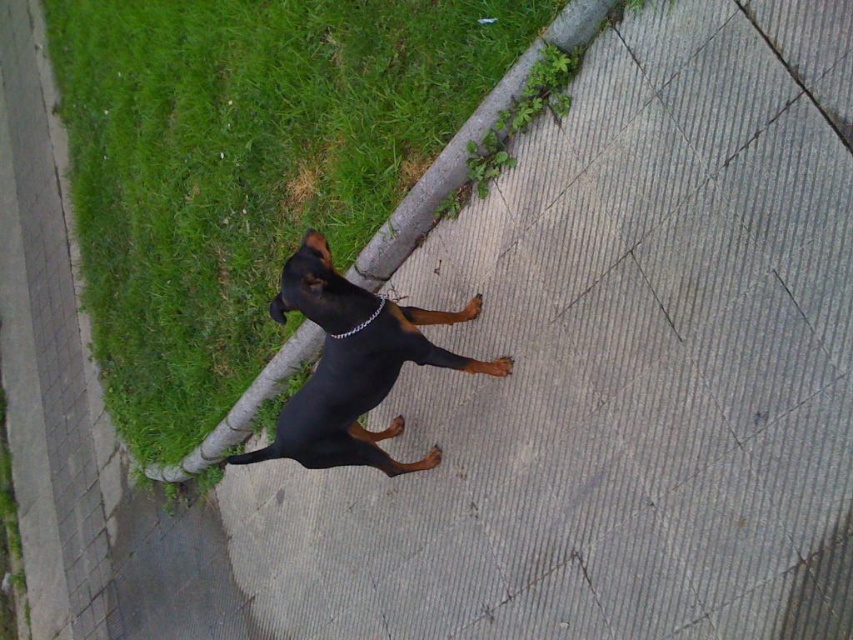
Which is behind, point (349, 164) or point (328, 269)?

The point (349, 164) is more distant.

What do you see at coordinates (244, 166) in the screenshot?
I see `green grass at upper left` at bounding box center [244, 166].

What are the coordinates of `green grass at upper left` in the screenshot? It's located at (244, 166).

Is green grass at upper left in front of silver metallic chain at center?

No, green grass at upper left is further to the viewer.

Does green grass at upper left appear on the left side of silver metallic chain at center?

Correct, you'll find green grass at upper left to the left of silver metallic chain at center.

Is point (131, 193) behind point (350, 332)?

Yes, it is.

I want to click on green grass at upper left, so click(244, 166).

In order to click on black smooth dog at center in this screenshot , I will do `click(352, 365)`.

Which is more to the left, black smooth dog at center or silver metallic chain at center?

From the viewer's perspective, black smooth dog at center appears more on the left side.

Which is in front, point (352, 385) or point (343, 332)?

Positioned in front is point (343, 332).

Where is `black smooth dog at center`? Image resolution: width=853 pixels, height=640 pixels. black smooth dog at center is located at coordinates (352, 365).